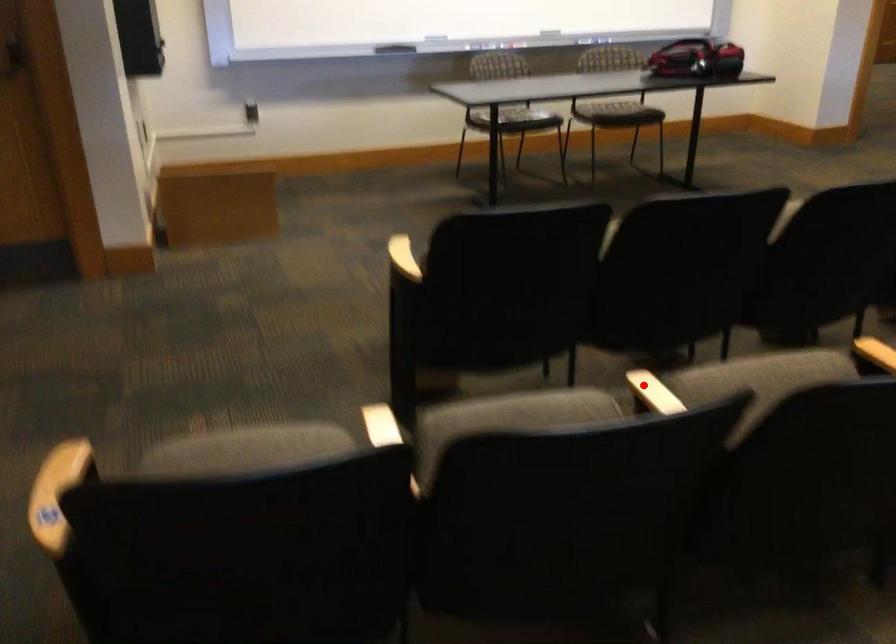
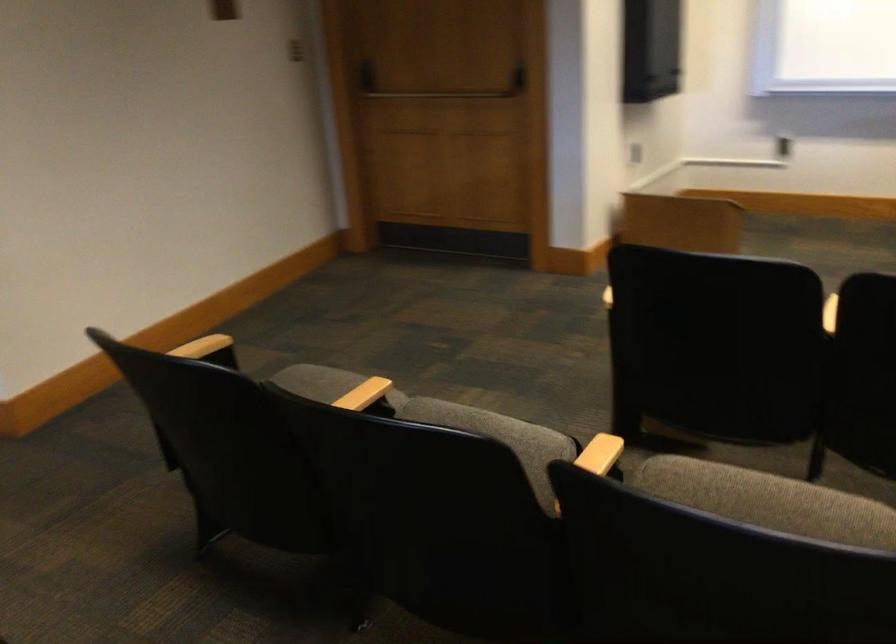
Question: I am providing you with two images of the same scene from different viewpoints. A red point is shown in image1. For the corresponding object point in image2, is it positioned nearer or farther from the camera?

Choices:
 (A) Nearer
 (B) Farther

Answer: (A)